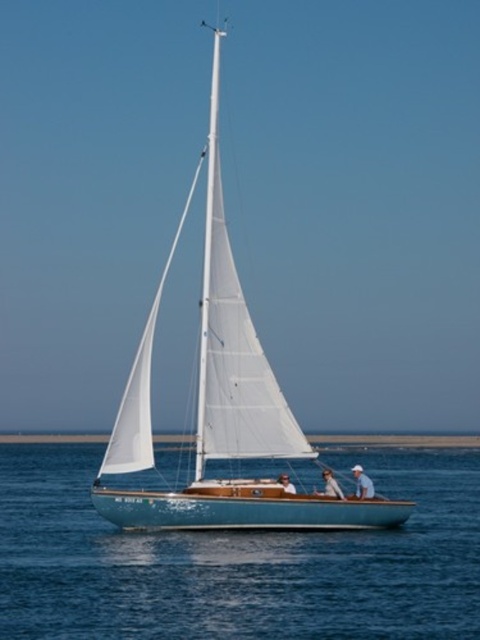
Based on the photo, you are a bird flying above the water and want to land on the closest object. Which object would you choose between the white fabric hat at lower center and the light blue fabric sailboat at center?

The light blue fabric sailboat at center is taller than the white fabric hat at lower center, so the bird should land on the white fabric hat at lower center since it is closer to the water.

You are standing on the deck of the sailboat and want to move from the point at coordinates point (372, 483) to the point at coordinates point (282, 474). Which direction should you move to get closer to the latter point?

You should move away from the viewer because point (372, 483) is further to the viewer than point (282, 474).